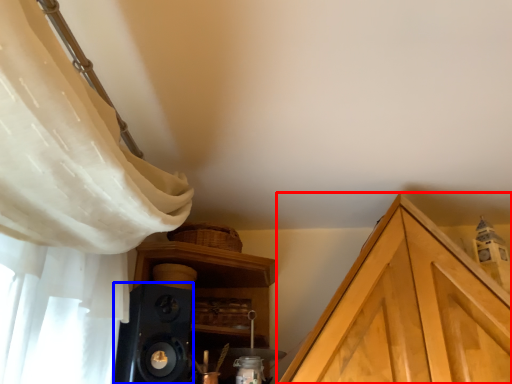
Question: Which point is closer to the camera, cabinetry (highlighted by a red box) or speaker (highlighted by a blue box)?

Choices:
 (A) cabinetry
 (B) speaker

Answer: (B)